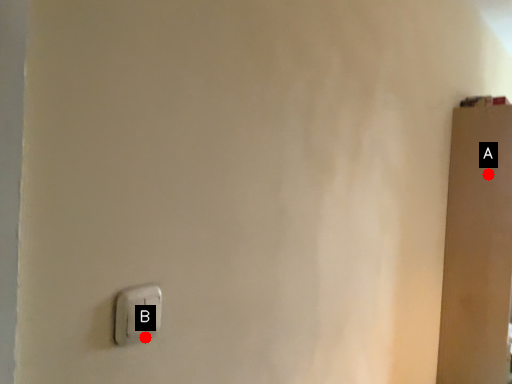
Question: Two points are circled on the image, labeled by A and B beside each circle. Which point appears farthest from the camera in this image?

Choices:
 (A) A is further
 (B) B is further

Answer: (A)